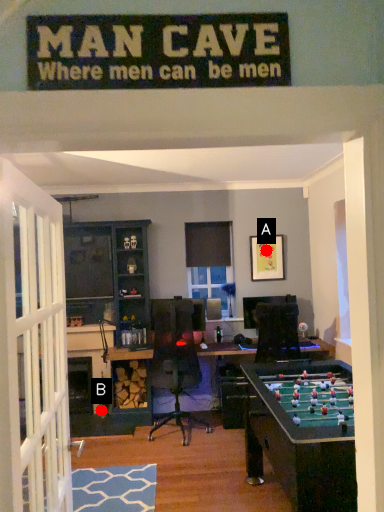
Question: Two points are circled on the image, labeled by A and B beside each circle. Which point is closer to the camera?

Choices:
 (A) A is closer
 (B) B is closer

Answer: (B)